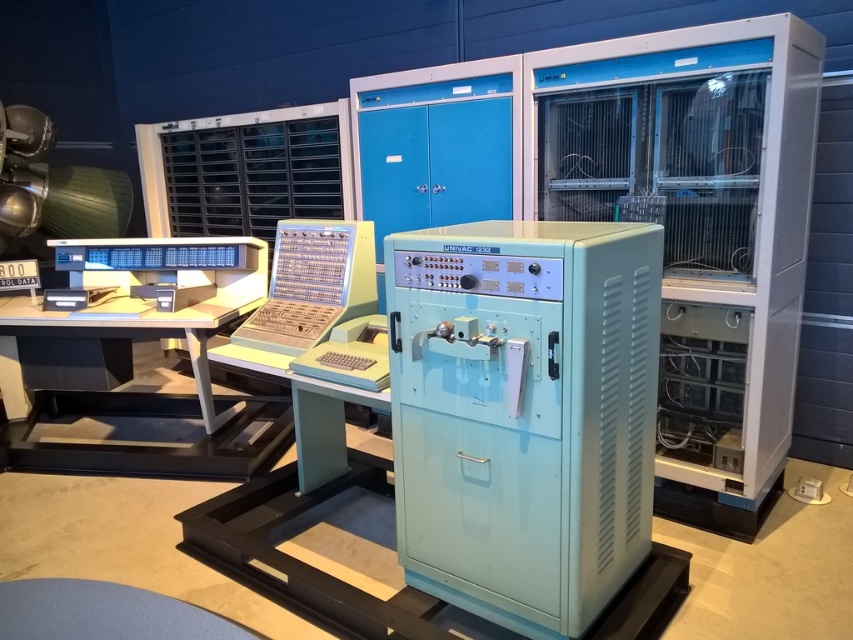
Can you confirm if light blue plastic univac 1502 at center is taller than yellow plastic keyboard at center?

Yes, light blue plastic univac 1502 at center is taller than yellow plastic keyboard at center.

The width and height of the screenshot is (853, 640). Find the location of `light blue plastic univac 1502 at center`. light blue plastic univac 1502 at center is located at coordinates (524, 413).

This screenshot has width=853, height=640. Describe the element at coordinates (524, 413) in the screenshot. I see `light blue plastic univac 1502 at center` at that location.

The height and width of the screenshot is (640, 853). Identify the location of light blue plastic univac 1502 at center. (524, 413).